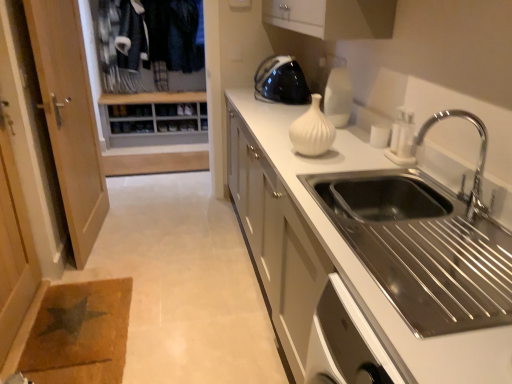
Question: Does wooden shoe rack at upper left have a lesser height compared to chrome metallic faucet at upper right?

Choices:
 (A) yes
 (B) no

Answer: (B)

Question: Is wooden shoe rack at upper left positioned before chrome metallic faucet at upper right?

Choices:
 (A) no
 (B) yes

Answer: (A)

Question: Considering the relative sizes of wooden shoe rack at upper left and chrome metallic faucet at upper right in the image provided, is wooden shoe rack at upper left smaller than chrome metallic faucet at upper right?

Choices:
 (A) no
 (B) yes

Answer: (A)

Question: Is wooden shoe rack at upper left facing towards chrome metallic faucet at upper right?

Choices:
 (A) yes
 (B) no

Answer: (A)

Question: Is wooden shoe rack at upper left taller than chrome metallic faucet at upper right?

Choices:
 (A) yes
 (B) no

Answer: (A)

Question: Considering the positions of point (168, 76) and point (305, 122), is point (168, 76) closer or farther from the camera than point (305, 122)?

Choices:
 (A) farther
 (B) closer

Answer: (A)

Question: Is wooden shoe rack at upper left situated inside white matte vase at center or outside?

Choices:
 (A) inside
 (B) outside

Answer: (B)

Question: From their relative heights in the image, would you say wooden shoe rack at upper left is taller or shorter than white matte vase at center?

Choices:
 (A) tall
 (B) short

Answer: (A)

Question: In terms of width, does wooden shoe rack at upper left look wider or thinner when compared to white matte vase at center?

Choices:
 (A) thin
 (B) wide

Answer: (B)

Question: In terms of size, does wooden shoe rack at upper left appear bigger or smaller than white matte countertop at center?

Choices:
 (A) small
 (B) big

Answer: (A)

Question: Is wooden shoe rack at upper left wider or thinner than white matte countertop at center?

Choices:
 (A) thin
 (B) wide

Answer: (A)

Question: Considering the relative positions of wooden shoe rack at upper left and white matte countertop at center in the image provided, is wooden shoe rack at upper left to the left or to the right of white matte countertop at center?

Choices:
 (A) left
 (B) right

Answer: (A)

Question: Is point (180, 72) closer or farther from the camera than point (400, 342)?

Choices:
 (A) farther
 (B) closer

Answer: (A)

Question: Is white glossy vase at upper center taller or shorter than white matte countertop at center?

Choices:
 (A) tall
 (B) short

Answer: (B)

Question: Considering the positions of point [x=347, y=105] and point [x=500, y=336], is point [x=347, y=105] closer or farther from the camera than point [x=500, y=336]?

Choices:
 (A) farther
 (B) closer

Answer: (A)